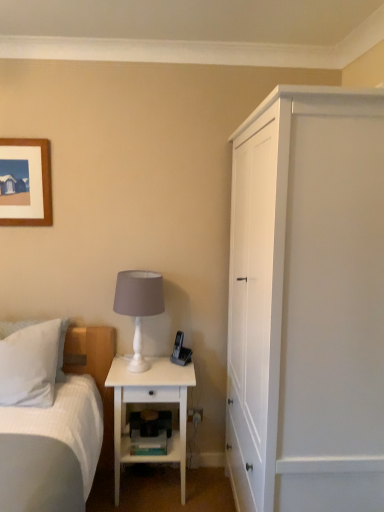
What do you see at coordinates (139, 306) in the screenshot? Image resolution: width=384 pixels, height=512 pixels. I see `white matte table lamp at center` at bounding box center [139, 306].

The height and width of the screenshot is (512, 384). What do you see at coordinates (150, 402) in the screenshot? I see `white matte nightstand at lower center` at bounding box center [150, 402].

This screenshot has height=512, width=384. Describe the element at coordinates (30, 365) in the screenshot. I see `white soft pillow at left` at that location.

What do you see at coordinates (307, 303) in the screenshot? Image resolution: width=384 pixels, height=512 pixels. I see `white matte cabinet at right` at bounding box center [307, 303].

The width and height of the screenshot is (384, 512). Identify the location of white matte table lamp at center. (139, 306).

Is white matte table lamp at center at the left side of white matte cabinet at right?

Correct, you'll find white matte table lamp at center to the left of white matte cabinet at right.

Is white matte table lamp at center outside of white matte cabinet at right?

Yes.

Is white matte table lamp at center facing away from white matte cabinet at right?

No, white matte table lamp at center is not facing the opposite direction of white matte cabinet at right.

Locate an element on the screen. cabinetry on the right of white matte table lamp at center is located at coordinates (307, 303).

Where is `pillow located on the left of white matte nightstand at lower center`? pillow located on the left of white matte nightstand at lower center is located at coordinates (30, 365).

Is white soft pillow at left looking in the opposite direction of white matte nightstand at lower center?

white soft pillow at left does not have its back to white matte nightstand at lower center.

What's the angular difference between white soft pillow at left and white matte nightstand at lower center's facing directions?

The angular difference between white soft pillow at left and white matte nightstand at lower center is 0.514 degrees.

Does white soft pillow at left lie in front of white matte nightstand at lower center?

Yes, it is in front of white matte nightstand at lower center.

From the image's perspective, is white matte nightstand at lower center above or below white matte cabinet at right?

From the image's perspective, white matte nightstand at lower center appears below white matte cabinet at right.

Between white matte nightstand at lower center and white matte cabinet at right, which one has smaller size?

Smaller between the two is white matte nightstand at lower center.

Is white matte nightstand at lower center positioned beyond the bounds of white matte cabinet at right?

white matte nightstand at lower center is positioned outside white matte cabinet at right.

How different are the orientations of white matte nightstand at lower center and white soft pillow at left in degrees?

The facing directions of white matte nightstand at lower center and white soft pillow at left are 0.514 degrees apart.

From the image's perspective, who appears lower, white matte nightstand at lower center or white soft pillow at left?

white matte nightstand at lower center.

Which object is positioned more to the right, white matte nightstand at lower center or white soft pillow at left?

white matte nightstand at lower center is more to the right.

Can you confirm if white matte cabinet at right is bigger than white soft pillow at left?

Yes.

Considering the sizes of objects white matte cabinet at right and white soft pillow at left in the image provided, who is wider, white matte cabinet at right or white soft pillow at left?

white matte cabinet at right.

This screenshot has height=512, width=384. I want to click on pillow that appears on the left of white matte cabinet at right, so click(30, 365).

How many degrees apart are the facing directions of white soft pillow at left and white matte cabinet at right?

90.7 degrees separate the facing orientations of white soft pillow at left and white matte cabinet at right.

Between white soft pillow at left and white matte cabinet at right, which one is positioned in front?

white matte cabinet at right is more forward.

Which object is wider, white soft pillow at left or white matte cabinet at right?

With larger width is white matte cabinet at right.

In the scene shown: Is white soft pillow at left turned away from white matte cabinet at right?

No.

From the image's perspective, who appears lower, white matte nightstand at lower center or white matte table lamp at center?

white matte nightstand at lower center, from the image's perspective.

Considering the relative sizes of white matte nightstand at lower center and white matte table lamp at center in the image provided, is white matte nightstand at lower center bigger than white matte table lamp at center?

Indeed, white matte nightstand at lower center has a larger size compared to white matte table lamp at center.

Is the surface of white matte nightstand at lower center in direct contact with white matte table lamp at center?

white matte nightstand at lower center is not next to white matte table lamp at center, and they're not touching.

Which object is further away from the camera, white matte nightstand at lower center or white matte table lamp at center?

white matte nightstand at lower center is behind.

Where is `cabinetry lying below the white matte table lamp at center (from the image's perspective)`? This screenshot has height=512, width=384. cabinetry lying below the white matte table lamp at center (from the image's perspective) is located at coordinates (x=307, y=303).

Locate an element on the screen. nightstand below the white soft pillow at left (from a real-world perspective) is located at coordinates (150, 402).

Based on their spatial positions, is white matte cabinet at right or white matte table lamp at center further from white soft pillow at left?

white matte cabinet at right.

When comparing their distances from white matte cabinet at right, does white soft pillow at left or white matte table lamp at center seem further?

white soft pillow at left is positioned further to the anchor white matte cabinet at right.

Which object lies nearer to the anchor point white matte table lamp at center, white soft pillow at left or white matte nightstand at lower center?

white matte nightstand at lower center is positioned closer to the anchor white matte table lamp at center.

When comparing their distances from white matte nightstand at lower center, does white matte cabinet at right or white soft pillow at left seem closer?

white soft pillow at left.

Looking at the image, which one is located further to white matte cabinet at right, white matte nightstand at lower center or white soft pillow at left?

Among the two, white soft pillow at left is located further to white matte cabinet at right.

Which object lies nearer to the anchor point white soft pillow at left, white matte nightstand at lower center or white matte cabinet at right?

Based on the image, white matte nightstand at lower center appears to be nearer to white soft pillow at left.

Estimate the real-world distances between objects in this image. Which object is closer to white matte nightstand at lower center, white matte table lamp at center or white matte cabinet at right?

white matte table lamp at center is positioned closer to the anchor white matte nightstand at lower center.

From the picture: From the image, which object appears to be farther from white soft pillow at left, white matte table lamp at center or white matte cabinet at right?

white matte cabinet at right is further to white soft pillow at left.

At what (x,y) coordinates should I click in order to perform the action: click on table lamp situated between white soft pillow at left and white matte cabinet at right from left to right. Please return your answer as a coordinate pair (x, y). The width and height of the screenshot is (384, 512). Looking at the image, I should click on (139, 306).

Locate an element on the screen. table lamp between white soft pillow at left and white matte nightstand at lower center from left to right is located at coordinates (139, 306).

Where is `table lamp between white matte cabinet at right and white matte nightstand at lower center in the front-back direction`? table lamp between white matte cabinet at right and white matte nightstand at lower center in the front-back direction is located at coordinates (139, 306).

Locate an element on the screen. The width and height of the screenshot is (384, 512). nightstand between white soft pillow at left and white matte cabinet at right in the horizontal direction is located at coordinates (150, 402).